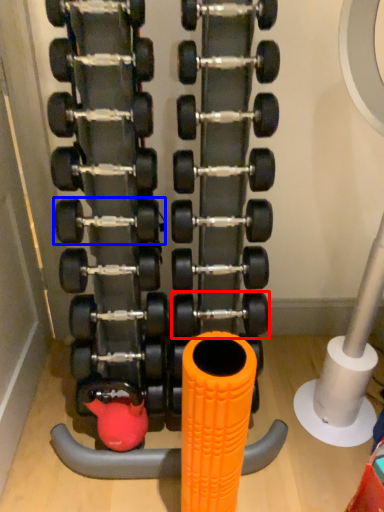
Question: Which object appears closest to the camera in this image, dumbbell (highlighted by a red box) or dumbbell (highlighted by a blue box)?

Choices:
 (A) dumbbell
 (B) dumbbell

Answer: (B)